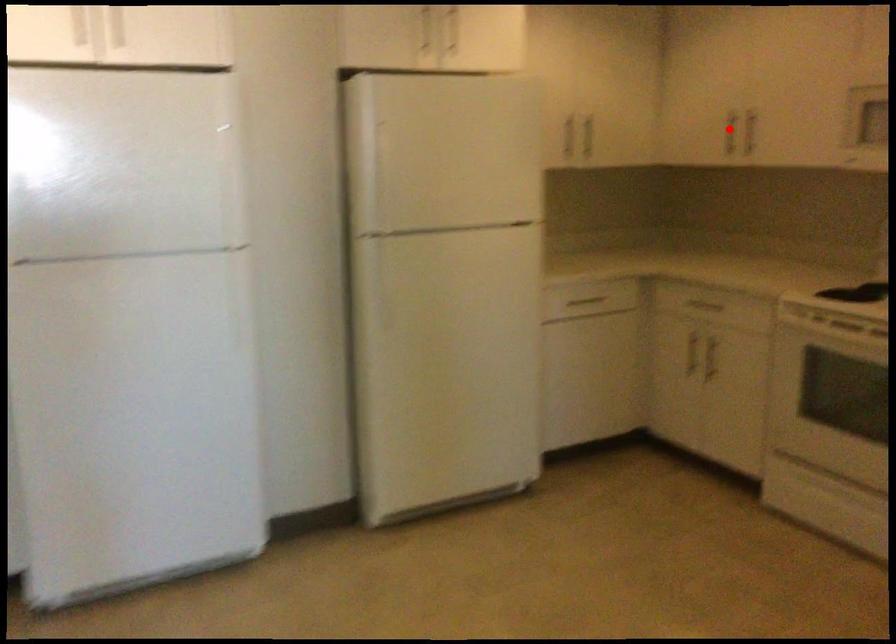
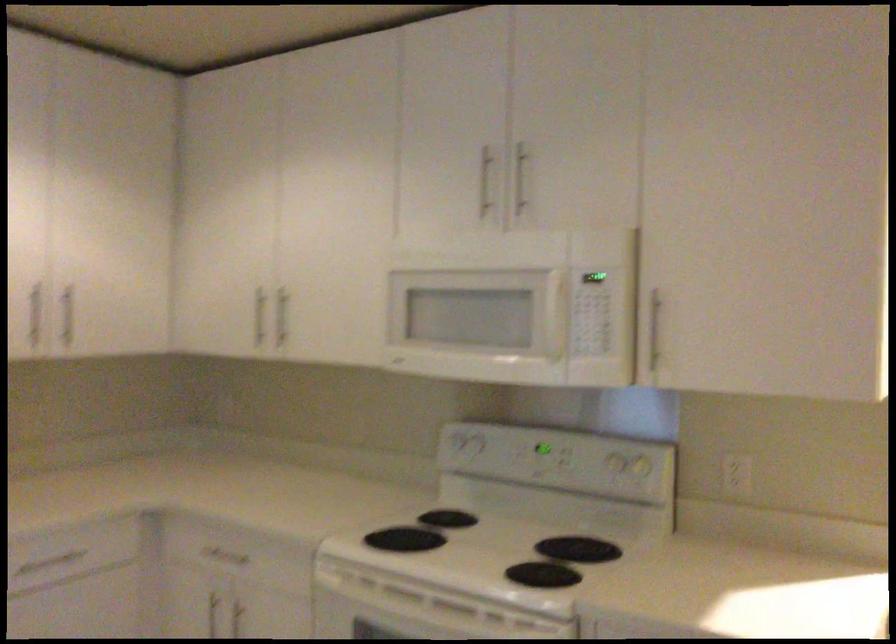
Question: I am providing you with two images of the same scene from different viewpoints. Image1 has a red point marked. In image2, the corresponding 3D location appears at what relative position? Reply with the corresponding letter.

Choices:
 (A) Closer
 (B) Farther

Answer: (A)